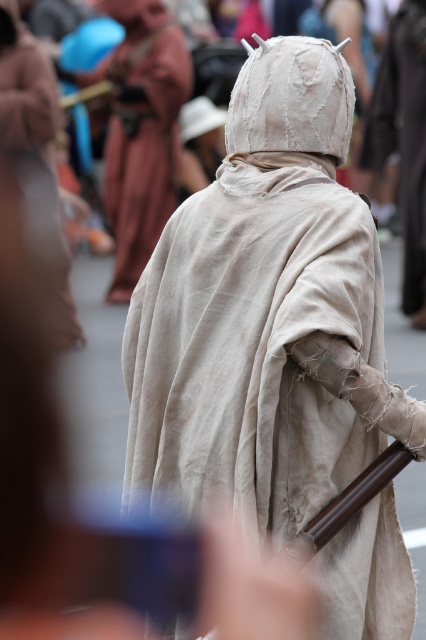
Question: Which object appears farthest from the camera in this image?

Choices:
 (A) beige fabric monk at center
 (B) light beige fabric monk at center

Answer: (B)

Question: Is beige fabric monk at center above light beige fabric monk at center?

Choices:
 (A) no
 (B) yes

Answer: (A)

Question: Can you confirm if beige fabric monk at center is positioned to the right of light beige fabric monk at center?

Choices:
 (A) yes
 (B) no

Answer: (A)

Question: Can you confirm if beige fabric monk at center is smaller than light beige fabric monk at center?

Choices:
 (A) no
 (B) yes

Answer: (B)

Question: Among these objects, which one is nearest to the camera?

Choices:
 (A) light beige fabric monk at center
 (B) beige fabric monk at center

Answer: (B)

Question: Which object is farther from the camera taking this photo?

Choices:
 (A) beige fabric monk at center
 (B) light beige fabric monk at center

Answer: (B)